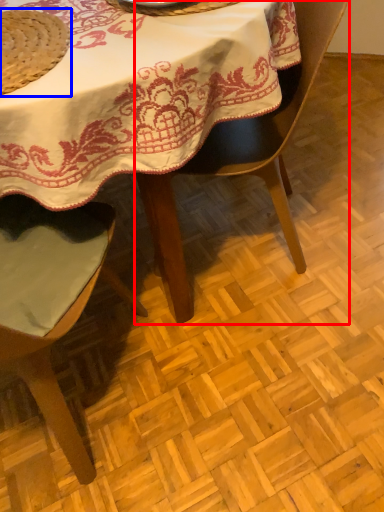
Question: Which of the following is the closest to the observer, chair (highlighted by a red box) or straw hat (highlighted by a blue box)?

Choices:
 (A) chair
 (B) straw hat

Answer: (B)